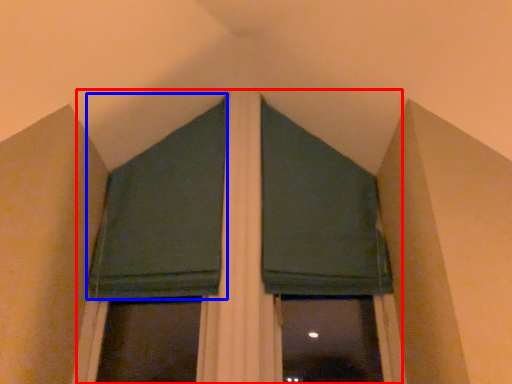
Question: Which of the following is the closest to the observer, bay window (highlighted by a red box) or curtain (highlighted by a blue box)?

Choices:
 (A) bay window
 (B) curtain

Answer: (A)